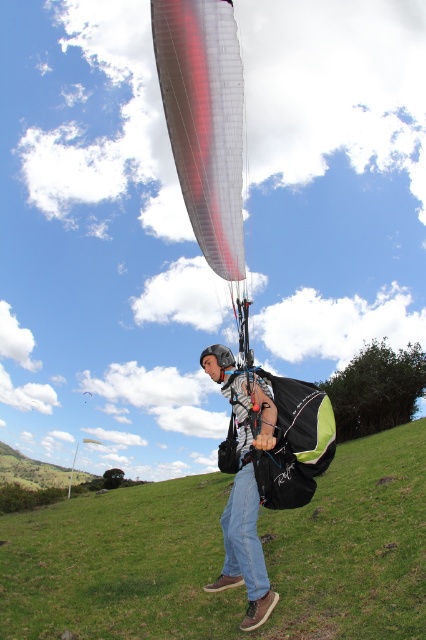
Question: Does green grassy field at lower center have a lesser width compared to red translucent fabric parachute at center?

Choices:
 (A) no
 (B) yes

Answer: (A)

Question: Which object is positioned farthest from the green grassy field at lower center?

Choices:
 (A) red translucent fabric parachute at center
 (B) denim jeans at center

Answer: (A)

Question: Which point appears closest to the camera in this image?

Choices:
 (A) (241, 442)
 (B) (241, 156)

Answer: (A)

Question: Is green grassy field at lower center wider than denim jeans at center?

Choices:
 (A) no
 (B) yes

Answer: (B)

Question: Can you confirm if green grassy field at lower center is positioned above red translucent fabric parachute at center?

Choices:
 (A) no
 (B) yes

Answer: (A)

Question: Estimate the real-world distances between objects in this image. Which object is farther from the red translucent fabric parachute at center?

Choices:
 (A) denim jeans at center
 (B) green grassy field at lower center

Answer: (B)